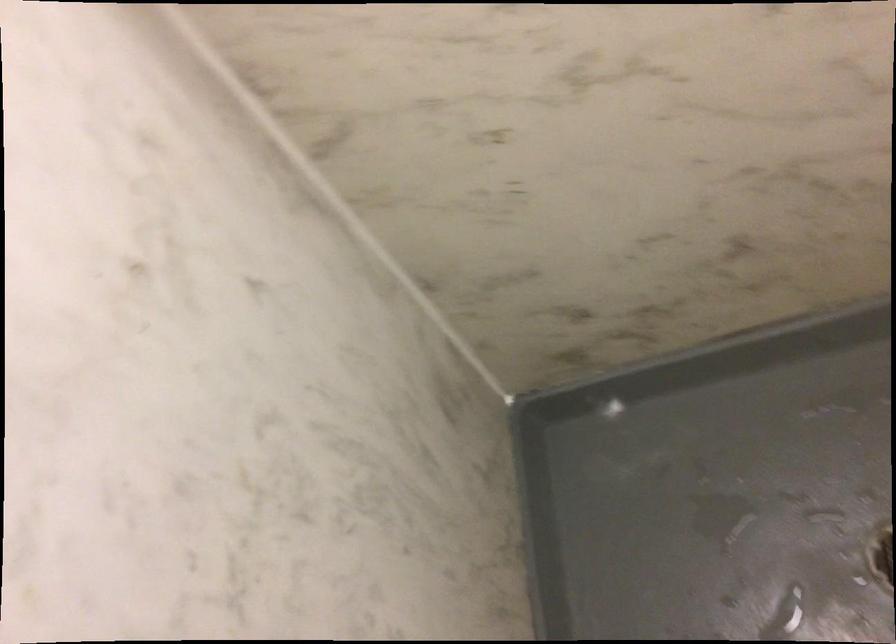
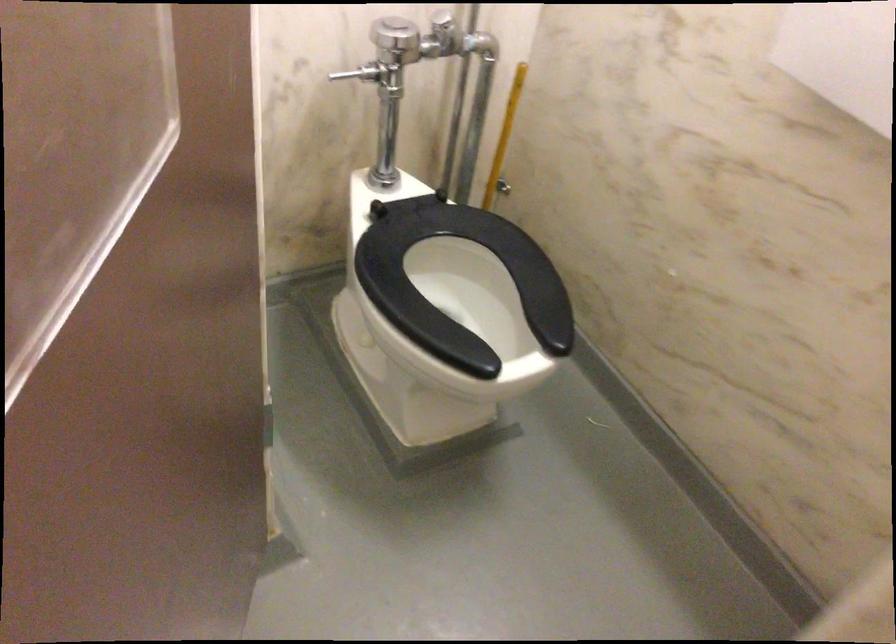
Question: The camera is either moving clockwise (left) or counter-clockwise (right) around the object. The first image is from the beginning of the video and the second image is from the end. Is the camera moving left or right when shooting the video?

Choices:
 (A) Left
 (B) Right

Answer: (A)